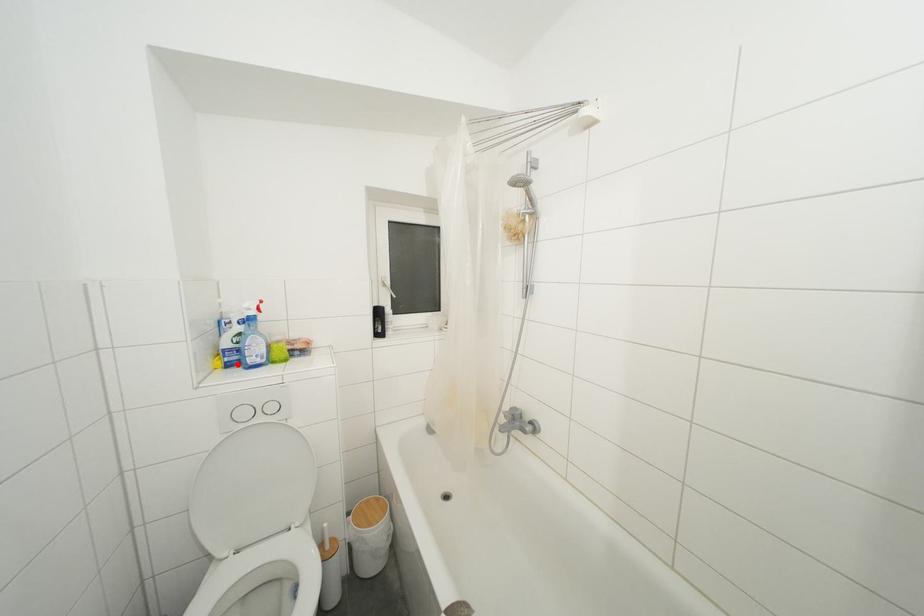
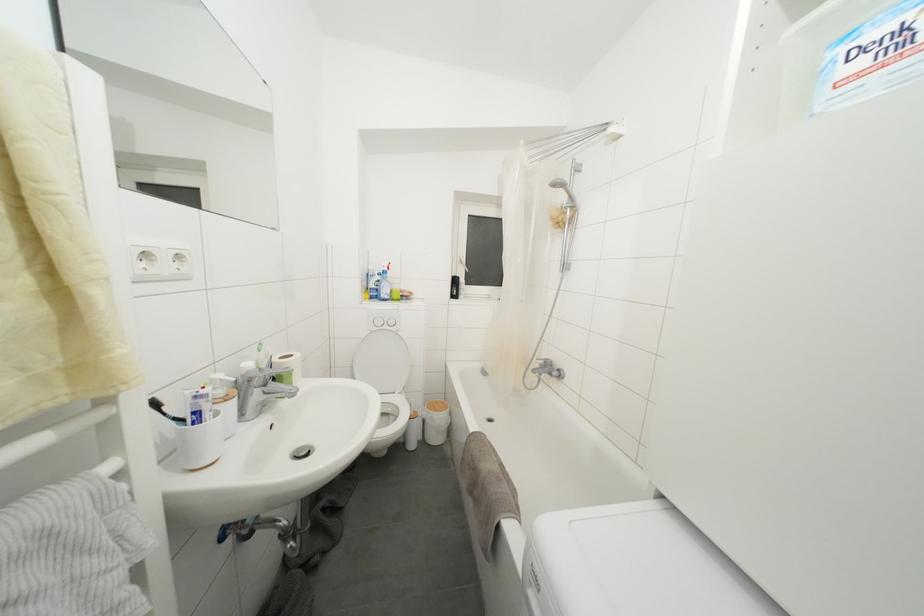
Find the pixel in the second image that matches the highlighted location in the first image.

(379, 300)